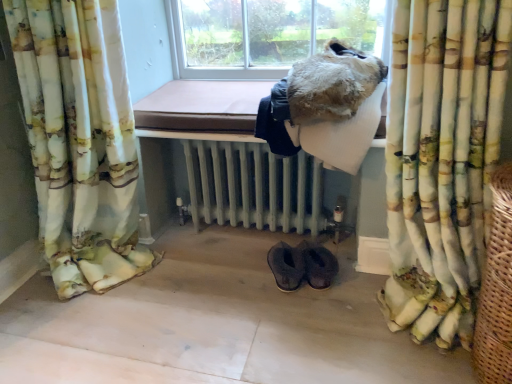
You are a GUI agent. You are given a task and a screenshot of the screen. Output one action in this format:
    pyautogui.click(x=<x>, y=<y>)
    Task: Click on the vacant space in front of white painted radiator at center
    The image size is (512, 384).
    Given the screenshot: What is the action you would take?
    click(238, 308)